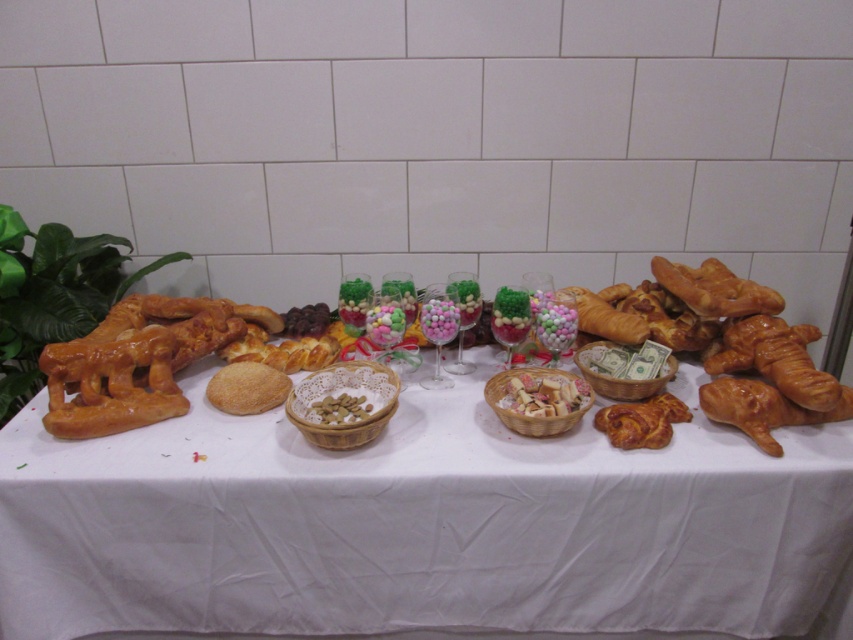
You are standing 4 feet away from a table with baked goods. There is a specific point marked at coordinates point (579, 396). Can you reach that point without moving closer to the table?

The distance of point (579, 396) from viewer is 3.98 feet, which is slightly less than 4 feet. Therefore, you can reach the point without moving closer to the table.